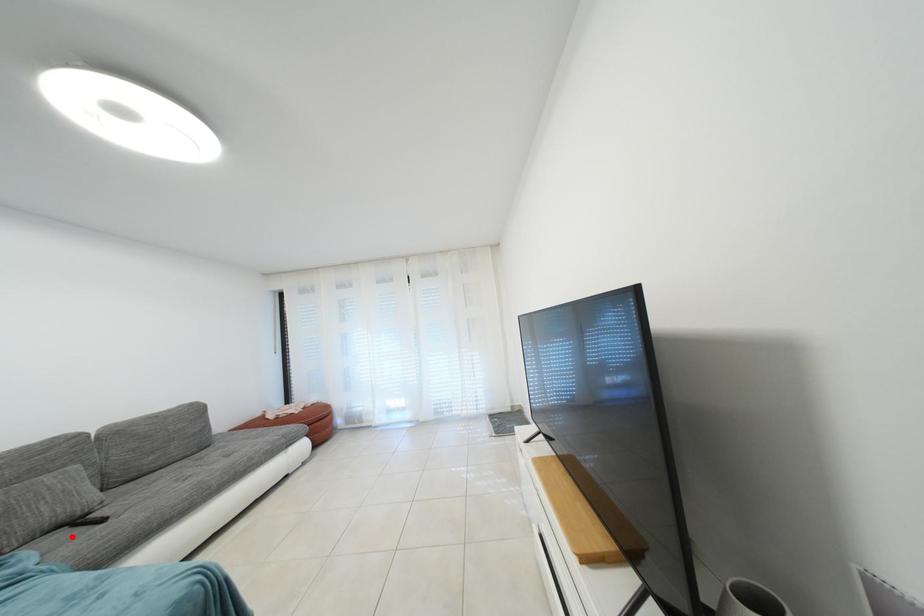
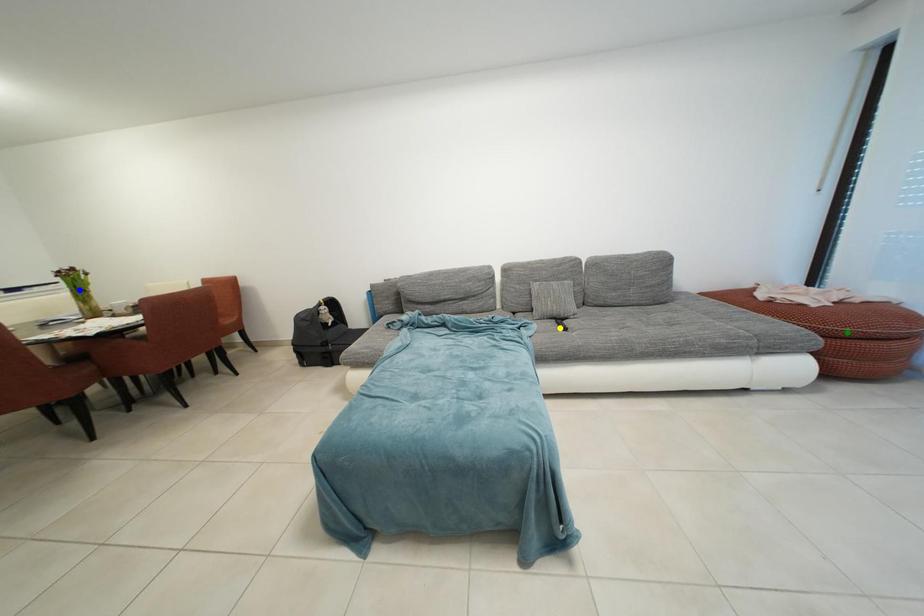
Question: I am providing you with two images of the same scene from different viewpoints. A red point is marked on the first image. You are given multiple points on the second image. Which point in image 2 is actually the same real-world point as the red point in image 1?

Choices:
 (A) blue point
 (B) green point
 (C) yellow point

Answer: (C)